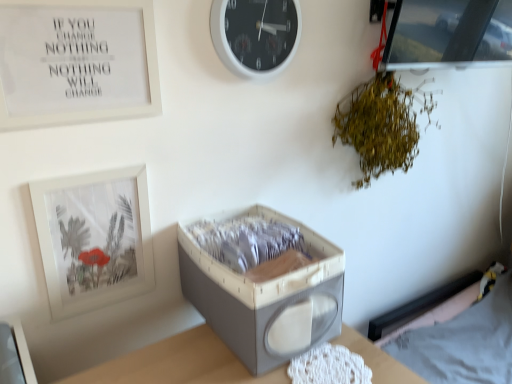
Question: From a real-world perspective, is green leafy plant at upper right physically located above or below white plastic wall clock at upper center?

Choices:
 (A) below
 (B) above

Answer: (A)

Question: Do you think green leafy plant at upper right is within white plastic wall clock at upper center, or outside of it?

Choices:
 (A) outside
 (B) inside

Answer: (A)

Question: Which object is the closest to the white matte picture frame at upper left, the 2th picture frame when ordered from right to left?

Choices:
 (A) white fabric hospital bed at lower right
 (B) white plastic wall clock at upper center
 (C) transparent glass picture frame at upper right, arranged as the 3th picture frame when viewed from the left
 (D) green leafy plant at upper right
 (E) white matte picture frame at upper left, which appears as the 1th picture frame when viewed from the left

Answer: (E)

Question: Which object is positioned farthest from the white plastic wall clock at upper center?

Choices:
 (A) white matte picture frame at upper left, which appears as the 1th picture frame when viewed from the left
 (B) gray fabric storage box at center
 (C) white fabric hospital bed at lower right
 (D) transparent glass picture frame at upper right, the 1th picture frame positioned from the top
 (E) green leafy plant at upper right

Answer: (C)